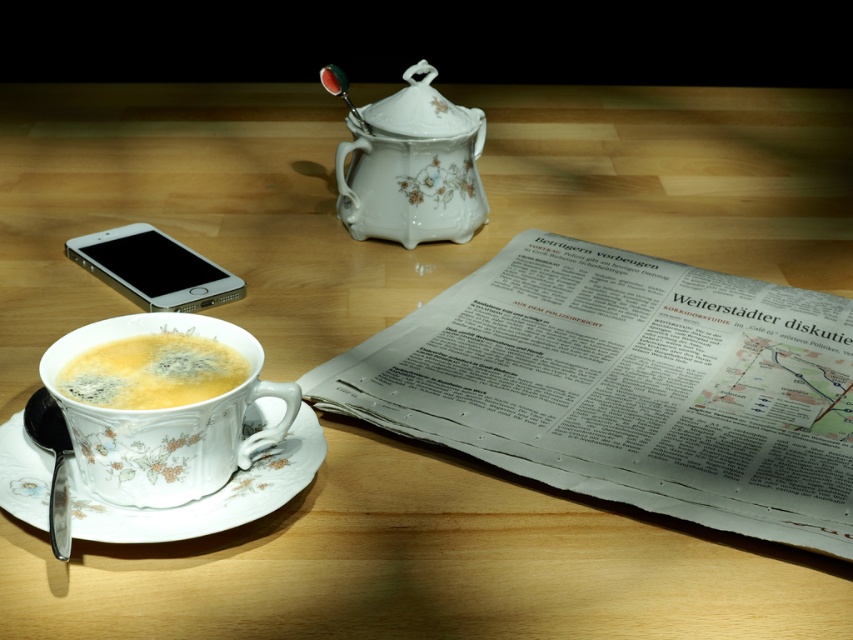
You are a barista trying to stack the porcelain cup at lower left and the silver metallic smartphone at lower left vertically on a narrow shelf. Which object would you place first to ensure both fit without toppling over?

The porcelain cup at lower left is much taller than the silver metallic smartphone at lower left, so you should place the shorter smartphone first to prevent the taller cup from toppling over when placed on top.

Based on the photo, you are a barista preparing a latte and need to choose between the porcelain cup at lower left and the silver metallic smartphone at lower left. Which object can hold more liquid?

The silver metallic smartphone at lower left cannot hold liquid, while the porcelain cup at lower left is designed to hold liquid. However, according to the description, the porcelain cup at lower left is smaller than the silver metallic smartphone at lower left, so if both could hold liquid, the smartphone might hold more. But since the smartphone isn